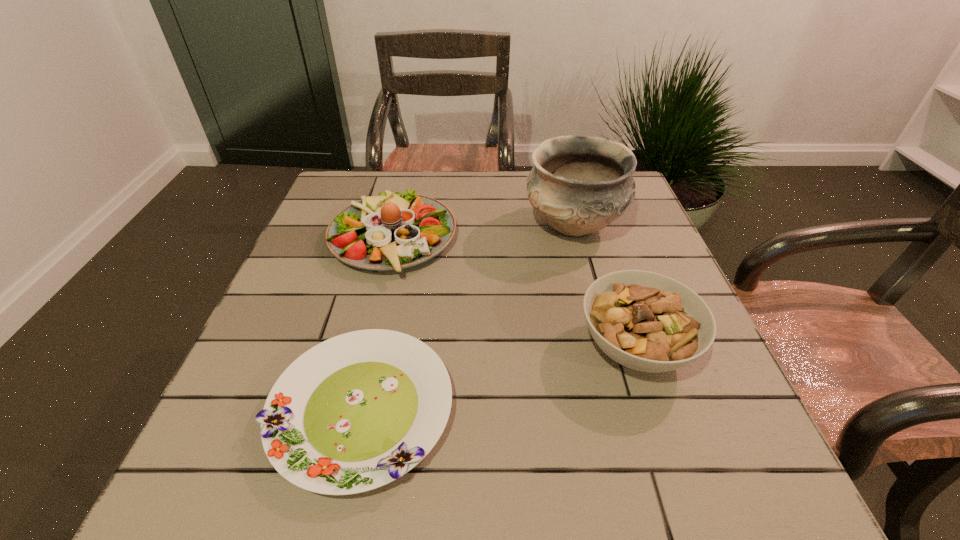
Locate an element on the screen. This screenshot has width=960, height=540. the tallest object is located at coordinates (579, 184).

Locate an element on the screen. This screenshot has height=540, width=960. the taller salad plate is located at coordinates (391, 231).

Locate an element on the screen. The image size is (960, 540). stew is located at coordinates (646, 321).

Locate an element on the screen. This screenshot has width=960, height=540. the nearer salad plate is located at coordinates (357, 411).

At what (x,y) coordinates should I click in order to perform the action: click on the shorter salad plate. Please return your answer as a coordinate pair (x, y). This screenshot has width=960, height=540. Looking at the image, I should click on (357, 411).

You are a GUI agent. You are given a task and a screenshot of the screen. Output one action in this format:
    pyautogui.click(x=<x>, y=<y>)
    Task: Click on the free location located 0.300m on the left of the pottery
    Image resolution: width=960 pixels, height=540 pixels.
    Given the screenshot: What is the action you would take?
    pyautogui.click(x=408, y=226)

The height and width of the screenshot is (540, 960). I want to click on free location located on the front of the farther salad plate, so click(x=354, y=399).

Where is `vacant point located 0.160m on the front of the stew`? The image size is (960, 540). vacant point located 0.160m on the front of the stew is located at coordinates (684, 493).

At what (x,y) coordinates should I click in order to perform the action: click on free region located on the right of the nearer salad plate. Please return your answer as a coordinate pair (x, y). Looking at the image, I should click on (512, 410).

In order to click on pottery present at the far edge in this screenshot , I will do `click(579, 184)`.